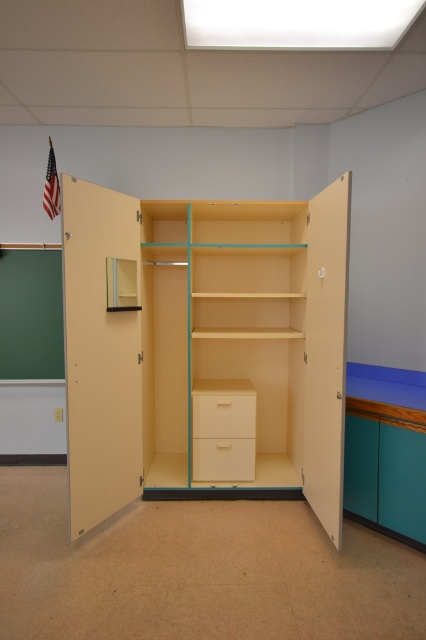
Who is positioned more to the left, matte yellow cabinet at center or matte cream drawer at center?

matte yellow cabinet at center

Who is positioned more to the right, matte yellow cabinet at center or matte cream drawer at center?

matte cream drawer at center

Find the location of a particular element. This screenshot has height=640, width=426. matte yellow cabinet at center is located at coordinates (204, 340).

Between green matte chalkboard at left and matte cream drawer at center, which one has less height?

With less height is matte cream drawer at center.

Who is more distant from viewer, (37, 275) or (209, 465)?

The point (37, 275) is behind.

The image size is (426, 640). Identify the location of green matte chalkboard at left. (31, 314).

Is matte yellow cabinet at center positioned behind matte wood drawer at center?

No.

From the picture: Is matte yellow cabinet at center to the left of matte wood drawer at center from the viewer's perspective?

Yes, matte yellow cabinet at center is to the left of matte wood drawer at center.

Which is behind, point (267, 268) or point (219, 458)?

Positioned behind is point (267, 268).

Image resolution: width=426 pixels, height=640 pixels. I want to click on matte yellow cabinet at center, so click(204, 340).